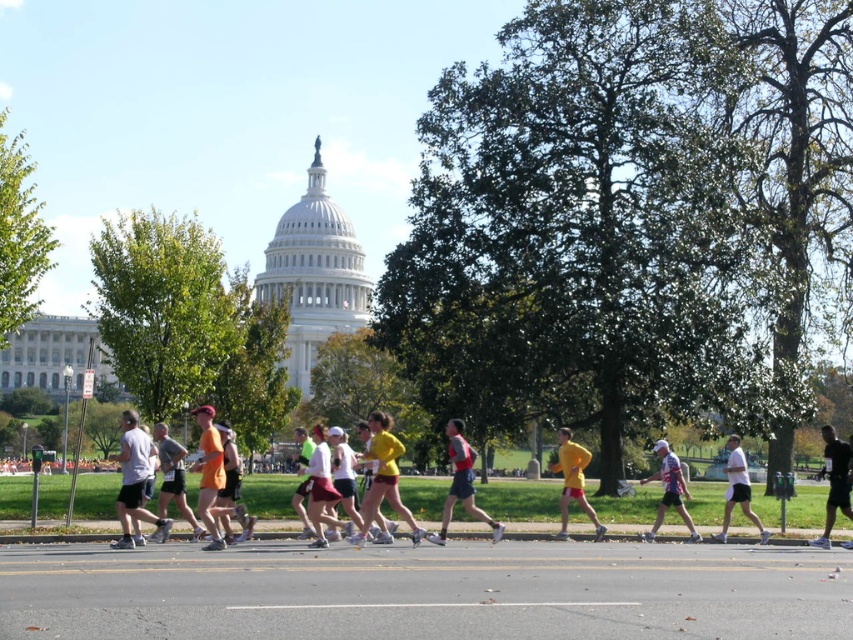
Which of these two, black athletic wear at center or white matte jersey at center, stands taller?

With more height is black athletic wear at center.

Can you confirm if black athletic wear at center is wider than white matte jersey at center?

Yes, black athletic wear at center is wider than white matte jersey at center.

The image size is (853, 640). I want to click on black athletic wear at center, so click(x=834, y=481).

Does yellow fabric shorts at center lie in front of white matte jersey at center?

Yes, yellow fabric shorts at center is closer to the viewer.

Measure the distance between yellow fabric shorts at center and camera.

The distance of yellow fabric shorts at center from camera is 115.43 meters.

The width and height of the screenshot is (853, 640). What are the coordinates of `yellow fabric shorts at center` in the screenshot? It's located at (383, 477).

This screenshot has width=853, height=640. I want to click on yellow fabric shorts at center, so click(x=383, y=477).

Locate an element on the screen. The height and width of the screenshot is (640, 853). gray cotton t-shirt at center is located at coordinates (135, 481).

Can you confirm if gray cotton t-shirt at center is positioned to the right of orange fabric shirt at center?

No, gray cotton t-shirt at center is not to the right of orange fabric shirt at center.

Describe the element at coordinates (135, 481) in the screenshot. I see `gray cotton t-shirt at center` at that location.

You are a GUI agent. You are given a task and a screenshot of the screen. Output one action in this format:
    pyautogui.click(x=<x>, y=<y>)
    Task: Click on the gray cotton t-shirt at center
    The width and height of the screenshot is (853, 640).
    Given the screenshot: What is the action you would take?
    pyautogui.click(x=135, y=481)